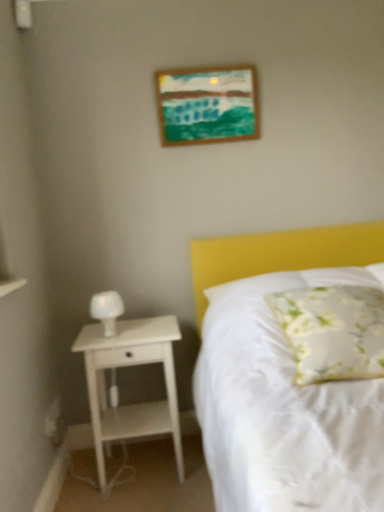
At what (x,y) coordinates should I click in order to perform the action: click on free location to the right of white matte bedside lamp at left. Please return your answer as a coordinate pair (x, y). Looking at the image, I should click on (147, 328).